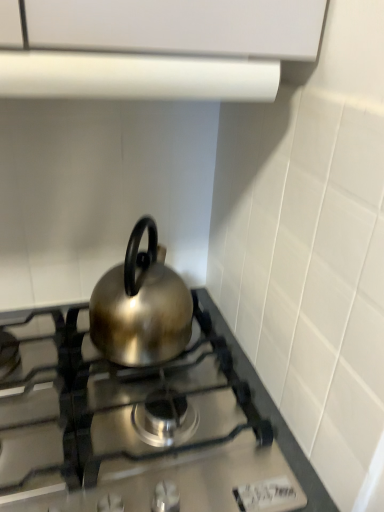
Question: Does satin silver kettle at center have a greater width compared to white matte vent at upper center?

Choices:
 (A) no
 (B) yes

Answer: (B)

Question: Can you confirm if satin silver kettle at center is positioned to the right of white matte vent at upper center?

Choices:
 (A) yes
 (B) no

Answer: (B)

Question: Is satin silver kettle at center smaller than white matte vent at upper center?

Choices:
 (A) no
 (B) yes

Answer: (A)

Question: Is satin silver kettle at center not close to white matte vent at upper center?

Choices:
 (A) no
 (B) yes

Answer: (A)

Question: Would you say white matte vent at upper center is part of satin silver kettle at center's contents?

Choices:
 (A) yes
 (B) no

Answer: (B)

Question: Is satin silver kettle at center placed right next to white matte vent at upper center?

Choices:
 (A) yes
 (B) no

Answer: (B)

Question: Are white matte vent at upper center and satin silver kettle at center far apart?

Choices:
 (A) yes
 (B) no

Answer: (B)

Question: Is white matte vent at upper center looking in the opposite direction of satin silver kettle at center?

Choices:
 (A) yes
 (B) no

Answer: (B)

Question: Is white matte vent at upper center shorter than satin silver kettle at center?

Choices:
 (A) no
 (B) yes

Answer: (B)

Question: From a real-world perspective, is white matte vent at upper center located beneath satin silver kettle at center?

Choices:
 (A) no
 (B) yes

Answer: (A)

Question: Does white matte vent at upper center come behind satin silver kettle at center?

Choices:
 (A) yes
 (B) no

Answer: (B)

Question: Is satin silver kettle at center inside white matte vent at upper center?

Choices:
 (A) no
 (B) yes

Answer: (A)

Question: Does satin silver kettle at center have a greater height compared to shiny metallic kettle at center?

Choices:
 (A) no
 (B) yes

Answer: (A)